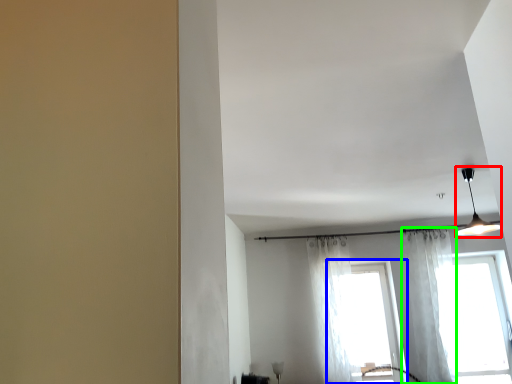
Question: Estimate the real-world distances between objects in this image. Which object is farther from light fixture (highlighted by a red box), window (highlighted by a blue box) or curtain (highlighted by a green box)?

Choices:
 (A) window
 (B) curtain

Answer: (A)